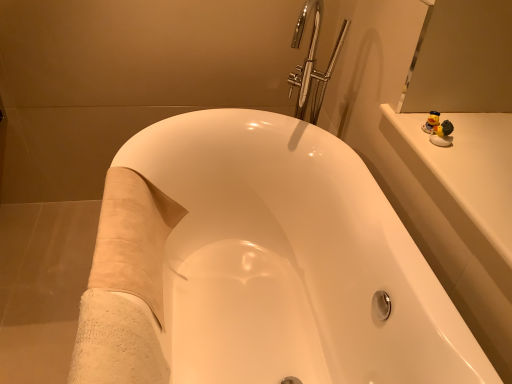
Where is `white glossy countertop at upper right`? The image size is (512, 384). white glossy countertop at upper right is located at coordinates (468, 171).

Measure the distance between white glossy countertop at upper right and camera.

A distance of 86.33 centimeters exists between white glossy countertop at upper right and camera.

What do you see at coordinates (468, 171) in the screenshot? I see `white glossy countertop at upper right` at bounding box center [468, 171].

Where is `white glossy countertop at upper right`? The width and height of the screenshot is (512, 384). white glossy countertop at upper right is located at coordinates (468, 171).